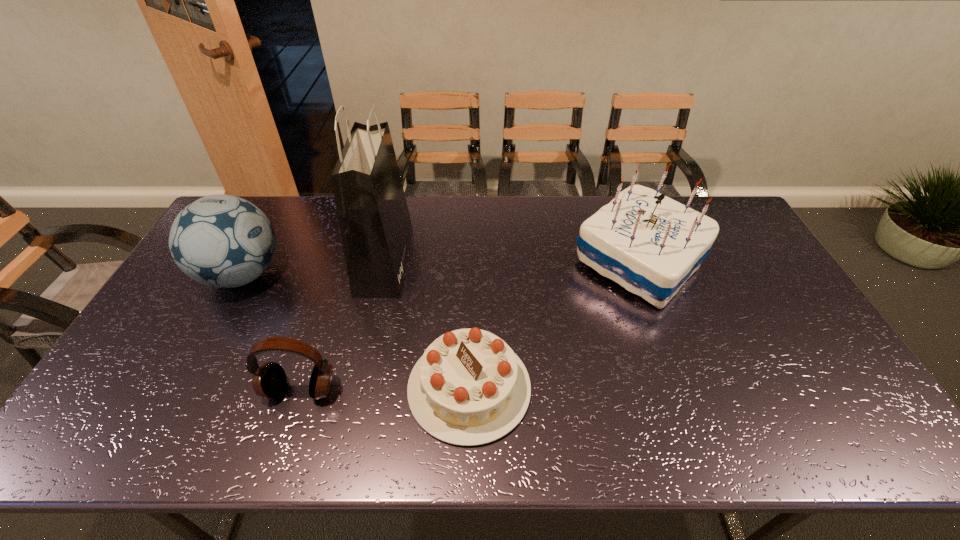
The width and height of the screenshot is (960, 540). What are the coordinates of `vacant space positioned 0.050m on the ear pads of the second shortest object` in the screenshot? It's located at (289, 426).

You are a GUI agent. You are given a task and a screenshot of the screen. Output one action in this format:
    pyautogui.click(x=<x>, y=<y>)
    Task: Click on the vacant space located on the right of the shorter birthday cake
    
    Given the screenshot: What is the action you would take?
    pyautogui.click(x=610, y=388)

Find the location of a particular element. Image resolution: width=960 pixels, height=540 pixels. shopping bag situated at the far edge is located at coordinates (375, 224).

Find the location of a particular element. This screenshot has height=540, width=960. birthday cake present at the far edge is located at coordinates (x=650, y=244).

Locate an element on the screen. object located at the near edge is located at coordinates (469, 388).

I want to click on object that is at the left edge, so click(x=223, y=241).

In the image, there is a desktop. At what (x,y) coordinates should I click in order to perform the action: click on vacant area at the far edge. Please return your answer as a coordinate pair (x, y). Looking at the image, I should click on (301, 195).

Where is `free point at the near edge`? free point at the near edge is located at coordinates (575, 433).

Locate an element on the screen. vacant space at the left edge of the desktop is located at coordinates (126, 387).

Find the location of a particular element. The image size is (960, 540). free point at the right edge is located at coordinates (747, 294).